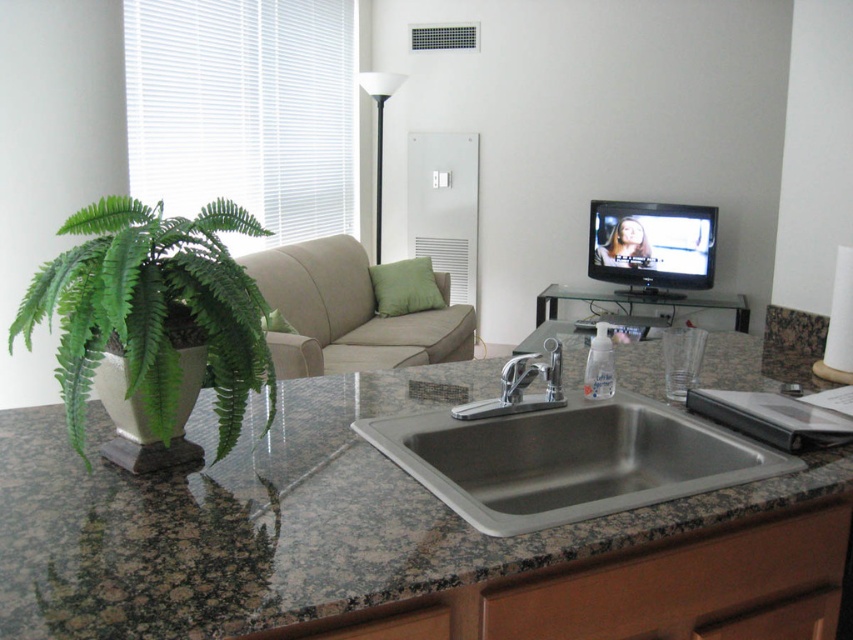
Who is shorter, granite at center or stainless steel sink at center?

With less height is stainless steel sink at center.

Does granite at center have a lesser height compared to stainless steel sink at center?

Incorrect, granite at center's height does not fall short of stainless steel sink at center's.

Is point (320, 525) positioned before point (659, 422)?

Yes, point (320, 525) is closer to viewer.

Where is `granite at center`? granite at center is located at coordinates (291, 522).

Does stainless steel sink at center have a greater height compared to white matte floor lamp at center?

No, stainless steel sink at center is not taller than white matte floor lamp at center.

Can you confirm if stainless steel sink at center is bigger than white matte floor lamp at center?

Actually, stainless steel sink at center might be smaller than white matte floor lamp at center.

Find the location of `stainless steel sink at center`. stainless steel sink at center is located at coordinates (567, 460).

Who is more forward, (187, 634) or (370, 80)?

Point (187, 634) is more forward.

Where is `granite at center`? The image size is (853, 640). granite at center is located at coordinates (291, 522).